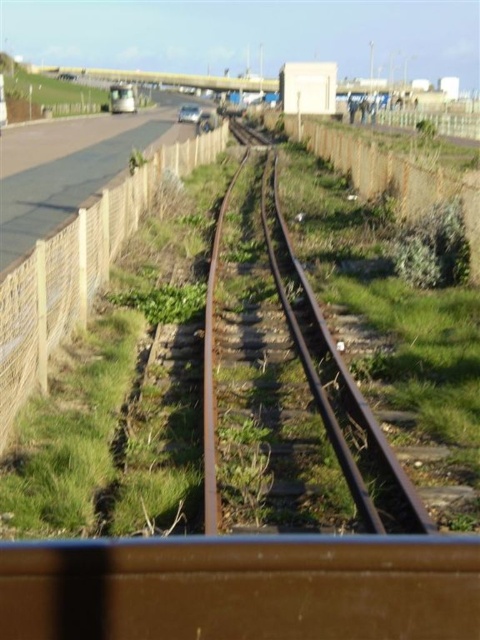
Question: Estimate the real-world distances between objects in this image. Which object is closer to the brown woven fence at center?

Choices:
 (A) brown woven fence at left
 (B) metallic silver bus at upper left
 (C) rusty metal track at center
 (D) green grass at center

Answer: (C)

Question: Based on their relative distances, which object is farther from the brown woven fence at left?

Choices:
 (A) metallic silver bus at upper left
 (B) green grass at center
 (C) brown woven fence at center
 (D) rusty metal track at center

Answer: (A)

Question: Observing the image, what is the correct spatial positioning of green grass at center in reference to brown woven fence at left?

Choices:
 (A) below
 (B) above

Answer: (A)

Question: Does rusty metal track at center appear on the left side of brown woven fence at center?

Choices:
 (A) no
 (B) yes

Answer: (B)

Question: Does rusty metal track at center have a smaller size compared to metallic silver bus at upper left?

Choices:
 (A) no
 (B) yes

Answer: (B)

Question: Among these points, which one is nearest to the camera?

Choices:
 (A) (283, 307)
 (B) (117, 97)
 (C) (139, 497)
 (D) (369, 157)

Answer: (C)